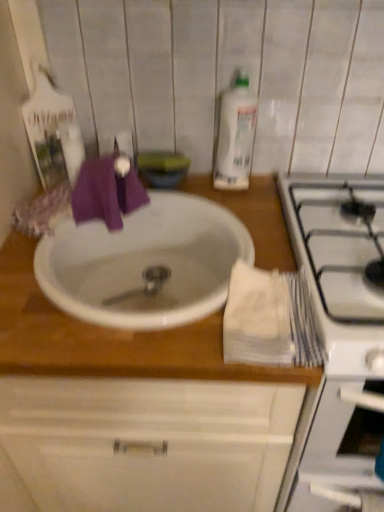
Question: In the image, is clear plastic bottle at upper center positioned in front of or behind white glossy stove at right?

Choices:
 (A) behind
 (B) front

Answer: (A)

Question: Is clear plastic bottle at upper center spatially inside white glossy stove at right, or outside of it?

Choices:
 (A) outside
 (B) inside

Answer: (A)

Question: Which of these objects is positioned closest to the white glossy stove at right?

Choices:
 (A) white glossy sink at center
 (B) white matte sink at center
 (C) clear plastic bottle at upper center

Answer: (B)

Question: Which object is positioned closest to the clear plastic bottle at upper center?

Choices:
 (A) white matte sink at center
 (B) white glossy sink at center
 (C) white glossy stove at right

Answer: (B)